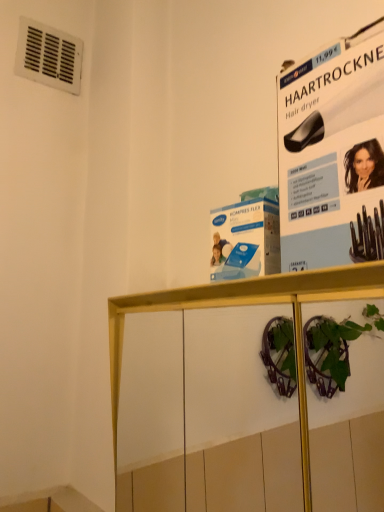
The image size is (384, 512). What are the coordinates of `white paper at upper right` in the screenshot? It's located at (332, 155).

Where is `wooden shelf at center`? wooden shelf at center is located at coordinates (248, 304).

At what (x,y) coordinates should I click in order to perform the action: click on white paper at upper right. Please return your answer as a coordinate pair (x, y). Image resolution: width=384 pixels, height=512 pixels. Looking at the image, I should click on (332, 155).

Find the location of a particular element. The width and height of the screenshot is (384, 512). air conditioning located behind the white paper at upper right is located at coordinates (49, 56).

Considering the sizes of white plastic vent at upper left and white paper at upper right in the image, is white plastic vent at upper left bigger or smaller than white paper at upper right?

Clearly, white plastic vent at upper left is smaller in size than white paper at upper right.

How far apart are white plastic vent at upper left and white paper at upper right?

The distance of white plastic vent at upper left from white paper at upper right is 33.02 inches.

Looking at this image, can you confirm if white plastic vent at upper left is positioned to the left of white paper at upper right?

Correct, you'll find white plastic vent at upper left to the left of white paper at upper right.

Between wooden shelf at center and white paper at upper right, which one has larger width?

Wider between the two is wooden shelf at center.

Considering the positions of objects wooden shelf at center and white paper at upper right in the image provided, who is more to the left, wooden shelf at center or white paper at upper right?

wooden shelf at center.

Does wooden shelf at center contain white paper at upper right?

Actually, white paper at upper right is outside wooden shelf at center.

What's the angular difference between wooden shelf at center and white paper at upper right's facing directions?

wooden shelf at center and white paper at upper right are facing 5.32 degrees away from each other.

How different are the orientations of white plastic vent at upper left and wooden shelf at center in degrees?

The angle between the facing direction of white plastic vent at upper left and the facing direction of wooden shelf at center is 91.3 degrees.

Considering the relative sizes of white plastic vent at upper left and wooden shelf at center in the image provided, is white plastic vent at upper left taller than wooden shelf at center?

In fact, white plastic vent at upper left may be shorter than wooden shelf at center.

Could you tell me if white plastic vent at upper left is turned towards wooden shelf at center?

No, white plastic vent at upper left is not turned towards wooden shelf at center.

From a real-world perspective, which is physically above, white paper at upper right or white plastic vent at upper left?

In real-world perspective, white plastic vent at upper left is above.

Considering the sizes of objects white paper at upper right and white plastic vent at upper left in the image provided, who is smaller, white paper at upper right or white plastic vent at upper left?

Smaller between the two is white plastic vent at upper left.

Looking at their sizes, would you say white paper at upper right is wider or thinner than white plastic vent at upper left?

In the image, white paper at upper right appears to be wider than white plastic vent at upper left.

Locate an element on the screen. air conditioning that appears on the left of white paper at upper right is located at coordinates (49, 56).

Is white paper at upper right aimed at wooden shelf at center?

No, white paper at upper right is not oriented towards wooden shelf at center.

Is white paper at upper right further to camera compared to wooden shelf at center?

Yes, it is behind wooden shelf at center.

Looking at this image, which is more to the left, white paper at upper right or wooden shelf at center?

From the viewer's perspective, wooden shelf at center appears more on the left side.

Based on their sizes in the image, would you say white paper at upper right is bigger or smaller than wooden shelf at center?

Considering their sizes, white paper at upper right takes up less space than wooden shelf at center.

Does wooden shelf at center turn towards white plastic vent at upper left?

No, wooden shelf at center is not facing towards white plastic vent at upper left.

Are wooden shelf at center and white plastic vent at upper left making contact?

No, wooden shelf at center is not beside white plastic vent at upper left.

Does wooden shelf at center have a lesser width compared to white plastic vent at upper left?

In fact, wooden shelf at center might be wider than white plastic vent at upper left.

Considering the sizes of objects wooden shelf at center and white plastic vent at upper left in the image provided, who is bigger, wooden shelf at center or white plastic vent at upper left?

Bigger between the two is wooden shelf at center.

You are a GUI agent. You are given a task and a screenshot of the screen. Output one action in this format:
    pyautogui.click(x=<x>, y=<y>)
    Task: Click on the poster page located underneath the white plastic vent at upper left (from a real-world perspective)
    
    Given the screenshot: What is the action you would take?
    pyautogui.click(x=332, y=155)

Where is `poster page that appears behind the wooden shelf at center`? The width and height of the screenshot is (384, 512). poster page that appears behind the wooden shelf at center is located at coordinates (332, 155).

When comparing their distances from white paper at upper right, does wooden shelf at center or white plastic vent at upper left seem further?

The object further to white paper at upper right is white plastic vent at upper left.

Looking at this image, based on their spatial positions, is white paper at upper right or wooden shelf at center closer to white plastic vent at upper left?

Among the two, wooden shelf at center is located nearer to white plastic vent at upper left.

Estimate the real-world distances between objects in this image. Which object is further from white paper at upper right, white plastic vent at upper left or wooden shelf at center?

white plastic vent at upper left is further to white paper at upper right.

Looking at the image, which one is located further to wooden shelf at center, white plastic vent at upper left or white paper at upper right?

The object further to wooden shelf at center is white plastic vent at upper left.

When comparing their distances from white plastic vent at upper left, does wooden shelf at center or white paper at upper right seem closer?

The object closer to white plastic vent at upper left is wooden shelf at center.

Based on their spatial positions, is white paper at upper right or white plastic vent at upper left closer to wooden shelf at center?

The object closer to wooden shelf at center is white paper at upper right.

The width and height of the screenshot is (384, 512). I want to click on poster page between wooden shelf at center and white plastic vent at upper left along the z-axis, so click(332, 155).